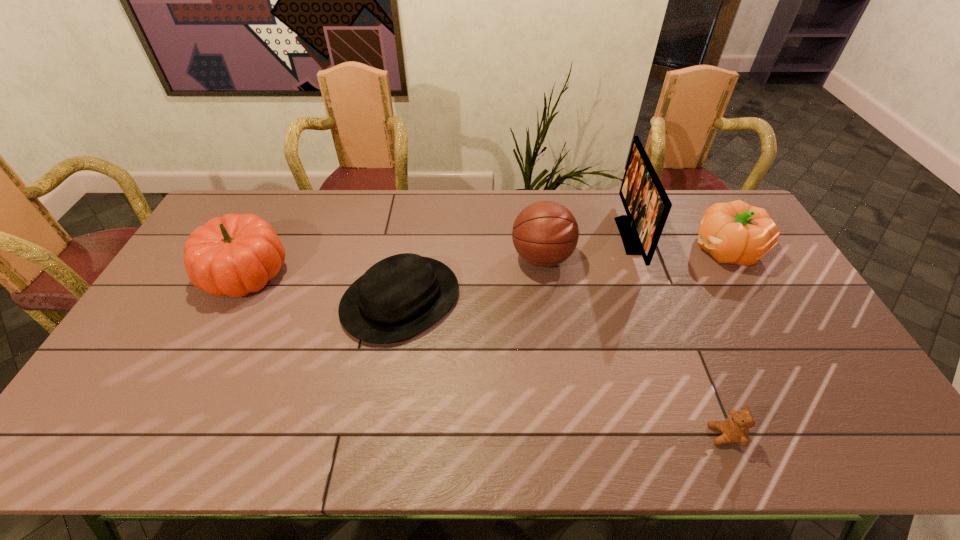
Find the location of `vacant space located on the back of the left pumpkin`. vacant space located on the back of the left pumpkin is located at coordinates (276, 212).

Where is `blank area located 0.250m on the carved face of the rightmost object`? The height and width of the screenshot is (540, 960). blank area located 0.250m on the carved face of the rightmost object is located at coordinates (616, 249).

Where is `vacant space located 0.110m on the carved face of the rightmost object`? This screenshot has height=540, width=960. vacant space located 0.110m on the carved face of the rightmost object is located at coordinates (659, 249).

The width and height of the screenshot is (960, 540). I want to click on free region located on the carved face of the rightmost object, so click(584, 249).

This screenshot has width=960, height=540. I want to click on vacant space located 0.210m on the back of the second object from left to right, so click(414, 219).

At what (x,y) coordinates should I click in order to perform the action: click on free location located 0.140m on the face of the nearest object. Please return your answer as a coordinate pair (x, y). The width and height of the screenshot is (960, 540). Looking at the image, I should click on (650, 435).

Identify the location of vacant region located 0.070m on the face of the nearest object. (680, 435).

Find the location of a particular element. vacant space positioned 0.120m on the face of the nearest object is located at coordinates (659, 435).

You are a GUI agent. You are given a task and a screenshot of the screen. Output one action in this format:
    pyautogui.click(x=<x>, y=<y>)
    Task: Click on the monitor at the far edge
    
    Given the screenshot: What is the action you would take?
    pyautogui.click(x=647, y=205)

The width and height of the screenshot is (960, 540). I want to click on pumpkin present at the far edge, so click(735, 232).